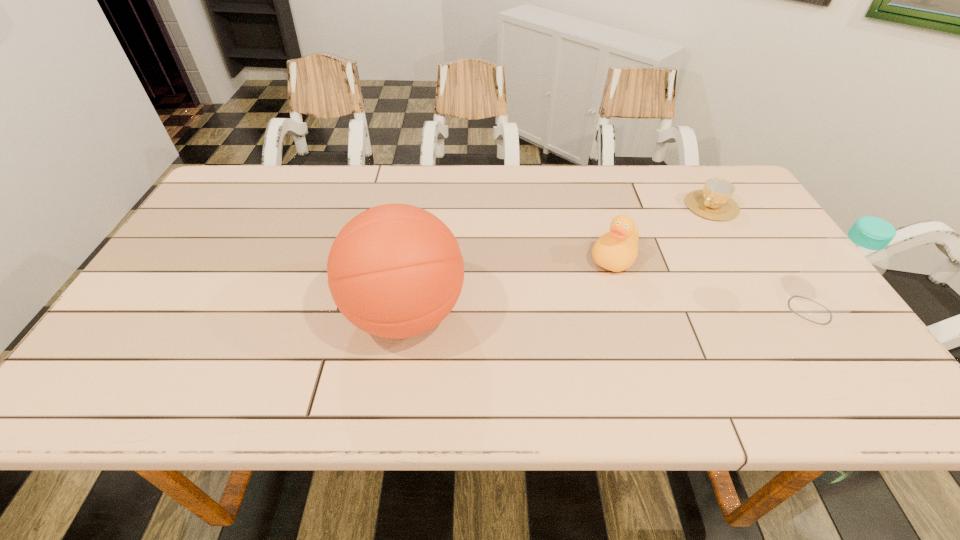
Where is `vacant space that's between the bottle and the cup`? Image resolution: width=960 pixels, height=540 pixels. vacant space that's between the bottle and the cup is located at coordinates (760, 258).

The width and height of the screenshot is (960, 540). In order to click on vacant space in between the bottle and the leftmost object in this screenshot , I will do `click(608, 312)`.

Image resolution: width=960 pixels, height=540 pixels. Find the location of `free space that is in between the cup and the leftmost object`. free space that is in between the cup and the leftmost object is located at coordinates (558, 260).

Find the location of a particular element. free spot between the bottle and the duck is located at coordinates (712, 284).

Identify which object is the second nearest to the second object from left to right. Please provide its 2D coordinates. Your answer should be formatted as a tuple, i.e. [(x, y)], where the tuple contains the x and y coordinates of a point satisfying the conditions above.

[(828, 288)]

The height and width of the screenshot is (540, 960). In order to click on object that is the second closest to the bottle in this screenshot , I will do `click(616, 250)`.

Locate an element on the screen. The height and width of the screenshot is (540, 960). blank space that satisfies the following two spatial constraints: 1. on the back side of the leftmost object; 2. on the left side of the bottle is located at coordinates (406, 310).

The height and width of the screenshot is (540, 960). I want to click on free location that satisfies the following two spatial constraints: 1. on the front side of the bottle; 2. on the left side of the farthest object, so click(x=774, y=310).

Where is `free region that satisfies the following two spatial constraints: 1. on the front side of the cup; 2. on the right side of the bottle`? The height and width of the screenshot is (540, 960). free region that satisfies the following two spatial constraints: 1. on the front side of the cup; 2. on the right side of the bottle is located at coordinates (774, 310).